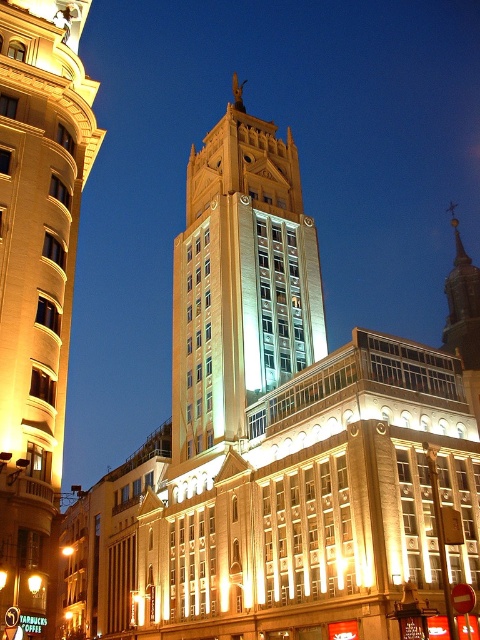
How distant is matte gold building at center from golden stone bell tower at center?

matte gold building at center and golden stone bell tower at center are 30.44 meters apart.

Can you confirm if matte gold building at center is positioned to the left of golden stone bell tower at center?

Correct, you'll find matte gold building at center to the left of golden stone bell tower at center.

At what (x,y) coordinates should I click in order to perform the action: click on matte gold building at center. Please return your answer as a coordinate pair (x, y). The width and height of the screenshot is (480, 640). Looking at the image, I should click on (37, 282).